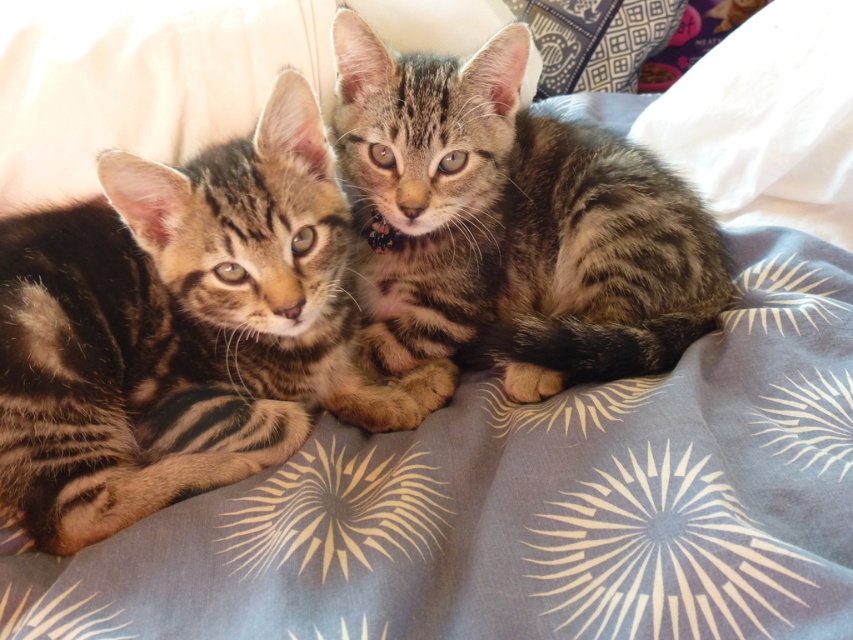
You are a photographer trying to capture a closeup shot of the striped fur kitten at center. You are currently 40 inches away from the kitten. Should you move closer or farther away to get the shot?

The striped fur kitten at center is 35.74 inches from the camera. To get a closeup shot, you should move closer to the kitten since you are currently 40 inches away, which is farther than the required distance.

You are a photographer trying to capture both kittens in a single shot. Since the striped fur kitten at center and the tabby fur kitten at center are close together, which one is more to the left?

The striped fur kitten at center is positioned on the left side of the tabby fur kitten at center, so the striped fur kitten at center is more to the left.

You are a photographer trying to capture both kittens in a single shot. Since the striped fur kitten at center and the tabby fur kitten at center are positioned differently, which one is lower in the frame?

The striped fur kitten at center is located below the tabby fur kitten at center, so it is lower in the frame.